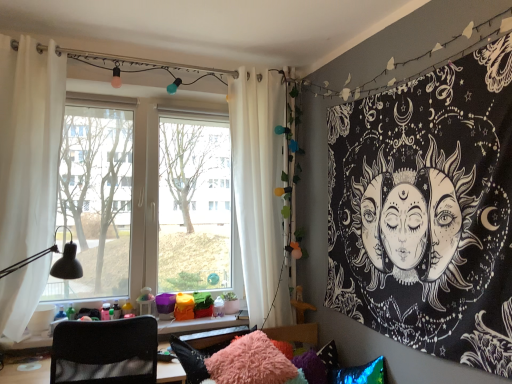
Question: Looking at the image, does white fabric curtain at right, the 1th curtain from the back, seem bigger or smaller compared to black paper tapestry at upper right?

Choices:
 (A) small
 (B) big

Answer: (B)

Question: Is white fabric curtain at right, the 1th curtain from the back, to the left or to the right of black paper tapestry at upper right in the image?

Choices:
 (A) right
 (B) left

Answer: (B)

Question: Which of these objects is positioned farthest from the transparent glass window at center?

Choices:
 (A) white fabric curtain at right, arranged as the 2th curtain when viewed from the left
 (B) black mesh chair at lower left
 (C) black matte table lamp at lower left
 (D) white sheer curtain at left, which is the second curtain from back to front
 (E) fuzzy pink pillow at lower center

Answer: (B)

Question: Which object is the farthest from the white sheer curtain at left, which is counted as the second curtain, starting from the right?

Choices:
 (A) black paper tapestry at upper right
 (B) fuzzy pink pillow at lower center
 (C) transparent glass window at center
 (D) black matte table lamp at lower left
 (E) white fabric curtain at right, the 1th curtain from the back

Answer: (A)